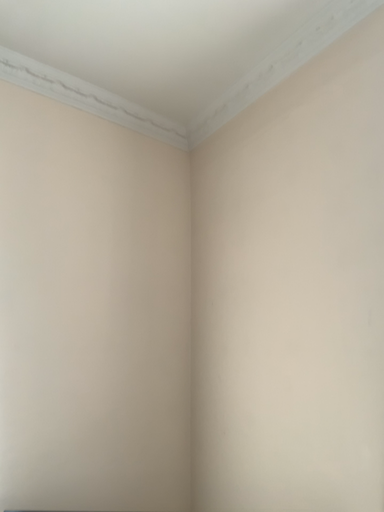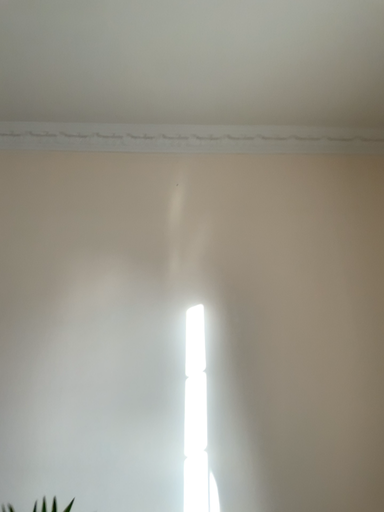
Question: How did the camera likely rotate when shooting the video?

Choices:
 (A) rotated right
 (B) rotated left

Answer: (B)